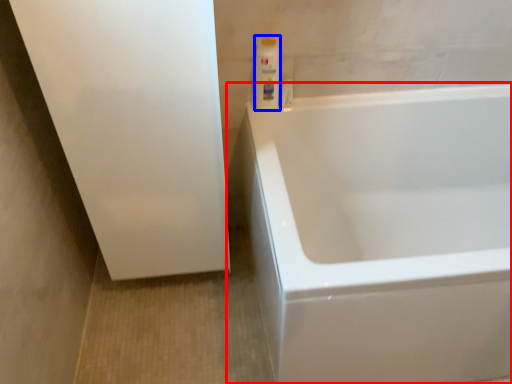
Question: Among these objects, which one is nearest to the camera, bathtub (highlighted by a red box) or cleaning product (highlighted by a blue box)?

Choices:
 (A) bathtub
 (B) cleaning product

Answer: (A)